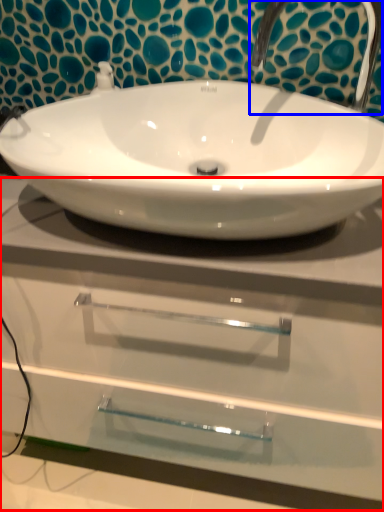
Question: Which point is further to the camera, counter top (highlighted by a red box) or plumbing fixture (highlighted by a blue box)?

Choices:
 (A) counter top
 (B) plumbing fixture

Answer: (B)